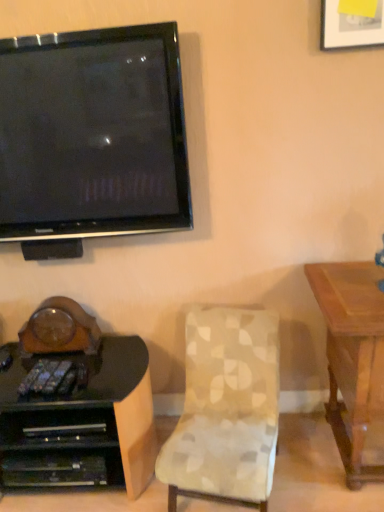
This screenshot has height=512, width=384. What are the coordinates of `free point above black glossy desk at lower left (from a real-world perspective)` in the screenshot? It's located at (52, 367).